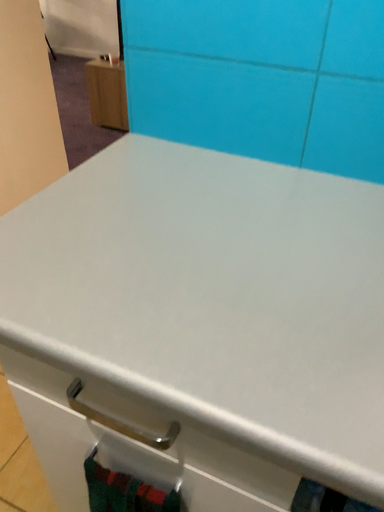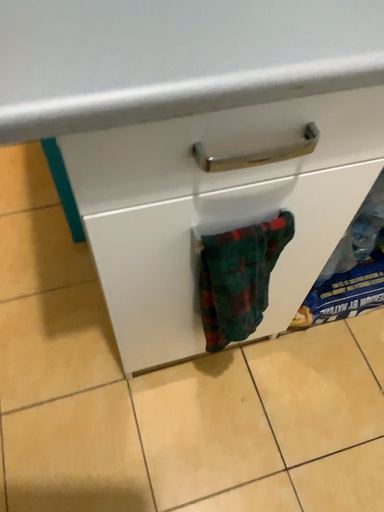
Question: Which way did the camera rotate in the video?

Choices:
 (A) rotated left
 (B) rotated right

Answer: (B)